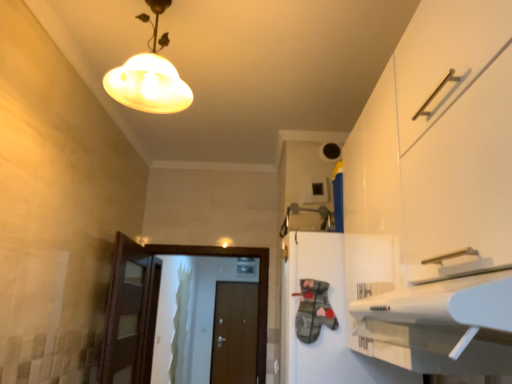
Question: Does matte glass lampshade at upper center appear on the right side of white glossy door at center, the 2th door positioned from the back?

Choices:
 (A) yes
 (B) no

Answer: (A)

Question: Does matte glass lampshade at upper center have a lesser height compared to white glossy door at center, which ranks as the first door in top-to-bottom order?

Choices:
 (A) no
 (B) yes

Answer: (B)

Question: Is matte glass lampshade at upper center at the left side of white glossy door at center, which ranks as the first door in top-to-bottom order?

Choices:
 (A) no
 (B) yes

Answer: (A)

Question: Considering the relative sizes of matte glass lampshade at upper center and white glossy door at center, which ranks as the first door in top-to-bottom order, in the image provided, is matte glass lampshade at upper center smaller than white glossy door at center, which ranks as the first door in top-to-bottom order,?

Choices:
 (A) yes
 (B) no

Answer: (A)

Question: Can you see matte glass lampshade at upper center touching white glossy door at center, which ranks as the first door in top-to-bottom order?

Choices:
 (A) yes
 (B) no

Answer: (B)

Question: From a real-world perspective, is matte glass lampshade at upper center positioned above or below white matte cabinet at center?

Choices:
 (A) below
 (B) above

Answer: (B)

Question: Based on their positions, is matte glass lampshade at upper center located to the left or right of white matte cabinet at center?

Choices:
 (A) right
 (B) left

Answer: (B)

Question: Relative to white matte cabinet at center, is matte glass lampshade at upper center in front or behind?

Choices:
 (A) front
 (B) behind

Answer: (A)

Question: Is matte glass lampshade at upper center wider or thinner than white matte cabinet at center?

Choices:
 (A) wide
 (B) thin

Answer: (B)

Question: Considering the positions of brown matte door at center, marked as the 1th door in a bottom-to-top arrangement, and matte glass lampshade at upper center in the image, is brown matte door at center, marked as the 1th door in a bottom-to-top arrangement, bigger or smaller than matte glass lampshade at upper center?

Choices:
 (A) small
 (B) big

Answer: (B)

Question: Considering the positions of point (247, 352) and point (168, 39), is point (247, 352) closer or farther from the camera than point (168, 39)?

Choices:
 (A) farther
 (B) closer

Answer: (A)

Question: From a real-world perspective, is brown matte door at center, which appears as the first door when viewed from the back, positioned above or below matte glass lampshade at upper center?

Choices:
 (A) above
 (B) below

Answer: (B)

Question: Which is correct: brown matte door at center, marked as the 1th door in a bottom-to-top arrangement, is inside matte glass lampshade at upper center, or outside of it?

Choices:
 (A) inside
 (B) outside

Answer: (B)

Question: From a real-world perspective, relative to matte glass lampshade at upper center, is white glossy door at center, the 2th door positioned from the back, vertically above or below?

Choices:
 (A) below
 (B) above

Answer: (A)

Question: Considering their positions, is white glossy door at center, placed as the 1th door when sorted from front to back, located in front of or behind matte glass lampshade at upper center?

Choices:
 (A) behind
 (B) front

Answer: (A)